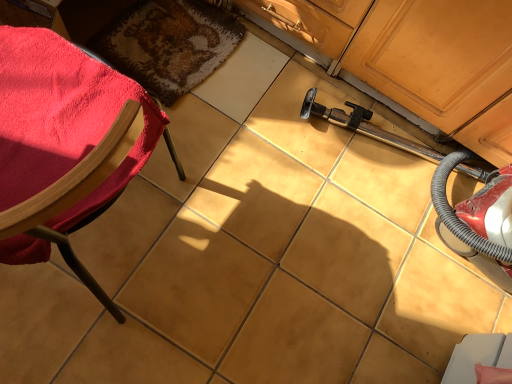
Where is `vacant space to the right of shaggy brown rug at upper left`? vacant space to the right of shaggy brown rug at upper left is located at coordinates [x=262, y=102].